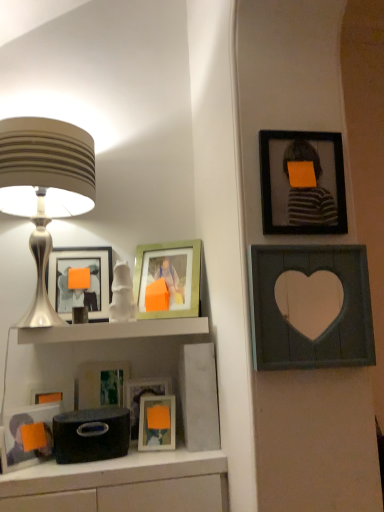
This screenshot has height=512, width=384. In order to click on matte black picture frame at left, positioned as the fifth picture frame in right-to-left order in this screenshot , I will do `click(81, 289)`.

Measure the distance between point [173,323] and camera.

They are 4.75 feet apart.

Describe the element at coordinates (91, 434) in the screenshot. I see `matte black box at center` at that location.

In order to click on silver metallic lampshade at left in this screenshot , I will do `click(45, 189)`.

The width and height of the screenshot is (384, 512). What are the coordinates of `matte black picture frame at left, positioned as the fifth picture frame in right-to-left order` in the screenshot? It's located at (81, 289).

Does point (350, 261) come behind point (149, 321)?

That is False.

Is wooden heart-shaped frame at upper right, arranged as the 1th picture frame when viewed from the right, taller than white glossy shelf at center?

Yes, wooden heart-shaped frame at upper right, arranged as the 1th picture frame when viewed from the right, is taller than white glossy shelf at center.

Which is more to the left, wooden heart-shaped frame at upper right, marked as the 7th picture frame in a left-to-right arrangement, or white glossy shelf at center?

Positioned to the left is white glossy shelf at center.

Which object is closer to the camera, wooden heart-shaped frame at upper right, arranged as the 1th picture frame when viewed from the right, or white glossy shelf at center?

wooden heart-shaped frame at upper right, arranged as the 1th picture frame when viewed from the right, is more forward.

Which is nearer, (155, 382) or (42, 399)?

The point (42, 399) is in front.

Starting from the matte glass picture frame at lower center, which is counted as the fourth picture frame, starting from the left, which picture frame is the 3rd one to the left? Please provide its 2D coordinates.

[(52, 393)]

From a real-world perspective, is matte glass picture frame at lower center, which is counted as the fourth picture frame, starting from the left, positioned above or below matte glass picture frame at lower left, which is counted as the seventh picture frame, starting from the right?

Clearly, from a real-world perspective, matte glass picture frame at lower center, which is counted as the fourth picture frame, starting from the left, is below matte glass picture frame at lower left, which is counted as the seventh picture frame, starting from the right.

Is matte glass picture frame at lower center, which is counted as the fourth picture frame, starting from the left, in front of or behind matte glass picture frame at lower left, which is counted as the seventh picture frame, starting from the right, in the image?

matte glass picture frame at lower center, which is counted as the fourth picture frame, starting from the left, is positioned closer to the viewer than matte glass picture frame at lower left, which is counted as the seventh picture frame, starting from the right.

Is matte black picture frame at lower left, marked as the sixth picture frame in a right-to-left arrangement, far away from matte orange picture frame at center, which is the fifth picture frame in left-to-right order?

No, matte black picture frame at lower left, marked as the sixth picture frame in a right-to-left arrangement, is not far from matte orange picture frame at center, which is the fifth picture frame in left-to-right order.

Between matte black picture frame at lower left, the second picture frame from the left, and matte orange picture frame at center, which is the fifth picture frame in left-to-right order, which one has smaller width?

matte orange picture frame at center, which is the fifth picture frame in left-to-right order.

Does matte black picture frame at lower left, marked as the sixth picture frame in a right-to-left arrangement, contain matte orange picture frame at center, which is the fifth picture frame in left-to-right order?

Actually, matte orange picture frame at center, which is the fifth picture frame in left-to-right order, is outside matte black picture frame at lower left, marked as the sixth picture frame in a right-to-left arrangement.

How different are the orientations of matte black picture frame at lower left, the second picture frame from the left, and matte orange picture frame at center, which is the fifth picture frame in left-to-right order, in degrees?

51.9 degrees separate the facing orientations of matte black picture frame at lower left, the second picture frame from the left, and matte orange picture frame at center, which is the fifth picture frame in left-to-right order.

From the image's perspective, between black matte picture frame at upper right, marked as the 6th picture frame in a left-to-right arrangement, and wooden heart-shaped frame at upper right, arranged as the 1th picture frame when viewed from the right, which one is located above?

black matte picture frame at upper right, marked as the 6th picture frame in a left-to-right arrangement, appears higher in the image.

Is point (290, 164) positioned in front of point (354, 298)?

No, (290, 164) is behind (354, 298).

Is black matte picture frame at upper right, marked as the 6th picture frame in a left-to-right arrangement, facing towards wooden heart-shaped frame at upper right, marked as the 7th picture frame in a left-to-right arrangement?

No, black matte picture frame at upper right, marked as the 6th picture frame in a left-to-right arrangement, is not facing towards wooden heart-shaped frame at upper right, marked as the 7th picture frame in a left-to-right arrangement.

How many degrees apart are the facing directions of matte black picture frame at lower left, marked as the sixth picture frame in a right-to-left arrangement, and matte black box at center?

matte black picture frame at lower left, marked as the sixth picture frame in a right-to-left arrangement, and matte black box at center are facing 38.1 degrees away from each other.

Does point (7, 460) come behind point (123, 408)?

No, it is in front of (123, 408).

Between matte black picture frame at lower left, the second picture frame from the left, and matte black box at center, which one has smaller size?

Smaller between the two is matte black box at center.

From a real-world perspective, between matte black picture frame at lower left, the second picture frame from the left, and matte black box at center, who is vertically lower?

In real-world perspective, matte black box at center is lower.

Does matte black box at center lie behind black matte picture frame at upper right, marked as the 6th picture frame in a left-to-right arrangement?

Yes, matte black box at center is behind black matte picture frame at upper right, marked as the 6th picture frame in a left-to-right arrangement.

Does matte black box at center appear on the right side of black matte picture frame at upper right, which is the 2th picture frame in right-to-left order?

In fact, matte black box at center is to the left of black matte picture frame at upper right, which is the 2th picture frame in right-to-left order.

Is black matte picture frame at upper right, which is the 2th picture frame in right-to-left order, a part of matte black box at center?

No, black matte picture frame at upper right, which is the 2th picture frame in right-to-left order, is not surrounded by matte black box at center.

Is matte black box at center oriented away from black matte picture frame at upper right, marked as the 6th picture frame in a left-to-right arrangement?

No, black matte picture frame at upper right, marked as the 6th picture frame in a left-to-right arrangement, is not at the back of matte black box at center.

From a real-world perspective, which object stands above the other?

Answer: wooden heart-shaped frame at upper right, marked as the 7th picture frame in a left-to-right arrangement, is physically above.

Is wooden heart-shaped frame at upper right, arranged as the 1th picture frame when viewed from the right, to the left of matte glass picture frame at lower left, which is counted as the seventh picture frame, starting from the right, from the viewer's perspective?

No.

From the image's perspective, does wooden heart-shaped frame at upper right, arranged as the 1th picture frame when viewed from the right, appear lower than matte glass picture frame at lower left, which is counted as the seventh picture frame, starting from the right?

No, from the image's perspective, wooden heart-shaped frame at upper right, arranged as the 1th picture frame when viewed from the right, is not below matte glass picture frame at lower left, which is counted as the seventh picture frame, starting from the right.

Are wooden heart-shaped frame at upper right, arranged as the 1th picture frame when viewed from the right, and matte glass picture frame at lower left, which is counted as the seventh picture frame, starting from the right, located far from each other?

wooden heart-shaped frame at upper right, arranged as the 1th picture frame when viewed from the right, is near matte glass picture frame at lower left, which is counted as the seventh picture frame, starting from the right, not far away.

You are a GUI agent. You are given a task and a screenshot of the screen. Output one action in this format:
    pyautogui.click(x=<x>, y=<y>)
    Task: Click on the shelf that appears behind the wooden heart-shaped frame at upper right, marked as the 7th picture frame in a left-to-right arrangement
    The width and height of the screenshot is (384, 512).
    Given the screenshot: What is the action you would take?
    pyautogui.click(x=114, y=330)

Locate an element on the screen. the 3rd picture frame counting from the right side of the matte glass picture frame at lower left, which is counted as the seventh picture frame, starting from the right is located at coordinates (141, 396).

From the image, which object appears to be nearer to matte black picture frame at left, acting as the 3th picture frame starting from the left, matte black box at center or matte glass picture frame at lower left, which is counted as the seventh picture frame, starting from the right?

The object closer to matte black picture frame at left, acting as the 3th picture frame starting from the left, is matte glass picture frame at lower left, which is counted as the seventh picture frame, starting from the right.

Looking at the image, which one is located closer to matte black picture frame at lower left, the second picture frame from the left, white glossy shelf at center or matte black box at center?

Based on the image, matte black box at center appears to be nearer to matte black picture frame at lower left, the second picture frame from the left.

Looking at the image, which one is located further to silver metallic lampshade at left, matte black picture frame at left, positioned as the fifth picture frame in right-to-left order, or white glossy shelf at center?

white glossy shelf at center is further to silver metallic lampshade at left.

Estimate the real-world distances between objects in this image. Which object is further from wooden heart-shaped frame at upper right, arranged as the 1th picture frame when viewed from the right, black matte picture frame at upper right, which is the 2th picture frame in right-to-left order, or matte glass picture frame at lower left, which is counted as the seventh picture frame, starting from the right?

Among the two, matte glass picture frame at lower left, which is counted as the seventh picture frame, starting from the right, is located further to wooden heart-shaped frame at upper right, arranged as the 1th picture frame when viewed from the right.

Looking at the image, which one is located closer to matte black picture frame at left, acting as the 3th picture frame starting from the left, matte glass picture frame at lower left, which is the first picture frame in left-to-right order, or white glossy shelf at center?

white glossy shelf at center is closer to matte black picture frame at left, acting as the 3th picture frame starting from the left.

Which object lies further to the anchor point matte black picture frame at left, acting as the 3th picture frame starting from the left, matte glass picture frame at lower left, which is the first picture frame in left-to-right order, or silver metallic lampshade at left?

matte glass picture frame at lower left, which is the first picture frame in left-to-right order, is further to matte black picture frame at left, acting as the 3th picture frame starting from the left.

Estimate the real-world distances between objects in this image. Which object is closer to matte black picture frame at lower left, marked as the sixth picture frame in a right-to-left arrangement, matte orange picture frame at center, the third picture frame from the right, or white glossy statue at center?

matte orange picture frame at center, the third picture frame from the right, lies closer to matte black picture frame at lower left, marked as the sixth picture frame in a right-to-left arrangement, than the other object.

From the image, which object appears to be farther from white glossy statue at center, wooden heart-shaped frame at upper right, arranged as the 1th picture frame when viewed from the right, or black matte picture frame at upper right, which is the 2th picture frame in right-to-left order?

black matte picture frame at upper right, which is the 2th picture frame in right-to-left order, is positioned further to the anchor white glossy statue at center.

You are a GUI agent. You are given a task and a screenshot of the screen. Output one action in this format:
    pyautogui.click(x=<x>, y=<y>)
    Task: Click on the lamp that lies between black matte picture frame at upper right, marked as the 6th picture frame in a left-to-right arrangement, and matte orange picture frame at center, the third picture frame from the right, from top to bottom
    
    Given the screenshot: What is the action you would take?
    pyautogui.click(x=45, y=189)

Locate an element on the screen. This screenshot has height=512, width=384. box located between matte black picture frame at lower left, marked as the sixth picture frame in a right-to-left arrangement, and wooden heart-shaped frame at upper right, arranged as the 1th picture frame when viewed from the right, in the left-right direction is located at coordinates (91, 434).

Identify the location of lamp that lies between black matte picture frame at upper right, which is the 2th picture frame in right-to-left order, and matte glass picture frame at lower center, which is counted as the fourth picture frame, starting from the left, from top to bottom. (45, 189).

Locate an element on the screen. The height and width of the screenshot is (512, 384). toy located between matte black picture frame at lower left, the second picture frame from the left, and wooden heart-shaped frame at upper right, arranged as the 1th picture frame when viewed from the right, in the left-right direction is located at coordinates (122, 294).